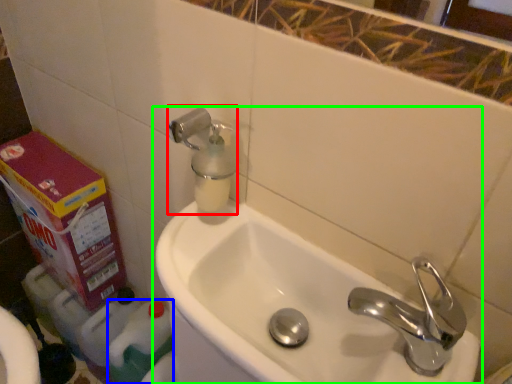
Question: Which is farther away from soap dispenser (highlighted by a red box)? cleaning product (highlighted by a blue box) or sink (highlighted by a green box)?

Choices:
 (A) cleaning product
 (B) sink

Answer: (A)